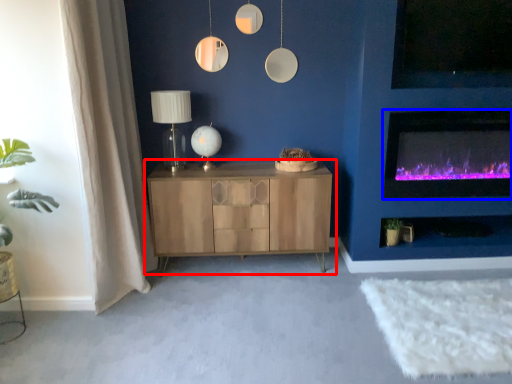
Question: Which object appears closest to the camera in this image, cabinetry (highlighted by a red box) or wood burning stove (highlighted by a blue box)?

Choices:
 (A) cabinetry
 (B) wood burning stove

Answer: (B)